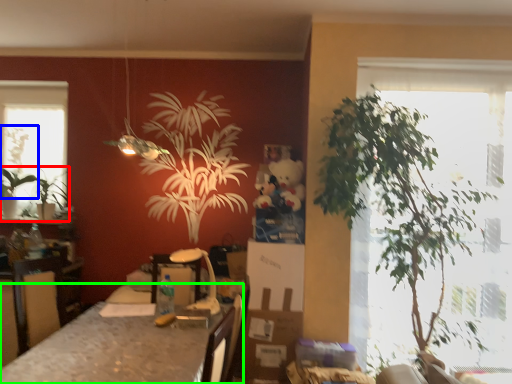
Question: Which object is the farthest from houseplant (highlighted by a red box)? Choose among these: plant (highlighted by a blue box) or table (highlighted by a green box).

Choices:
 (A) plant
 (B) table

Answer: (B)